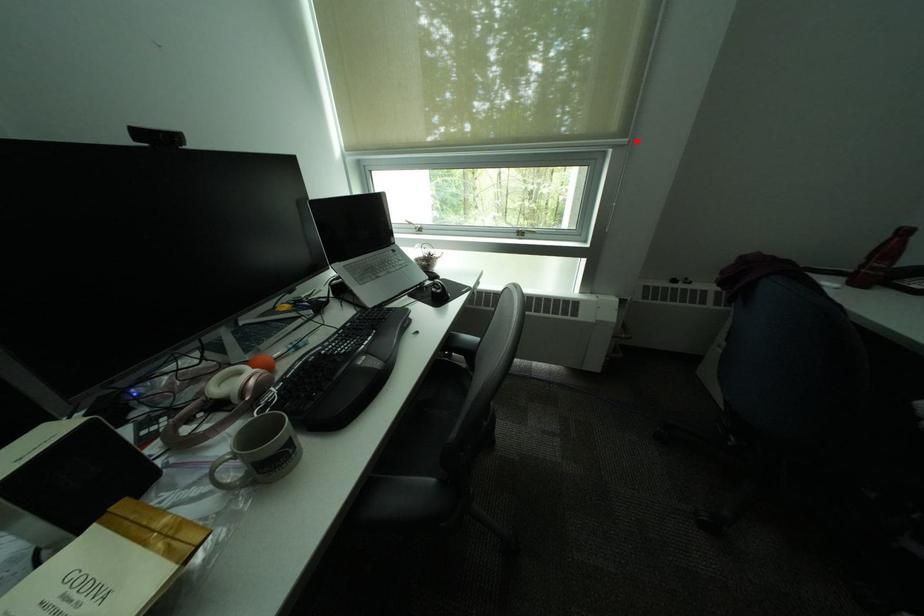
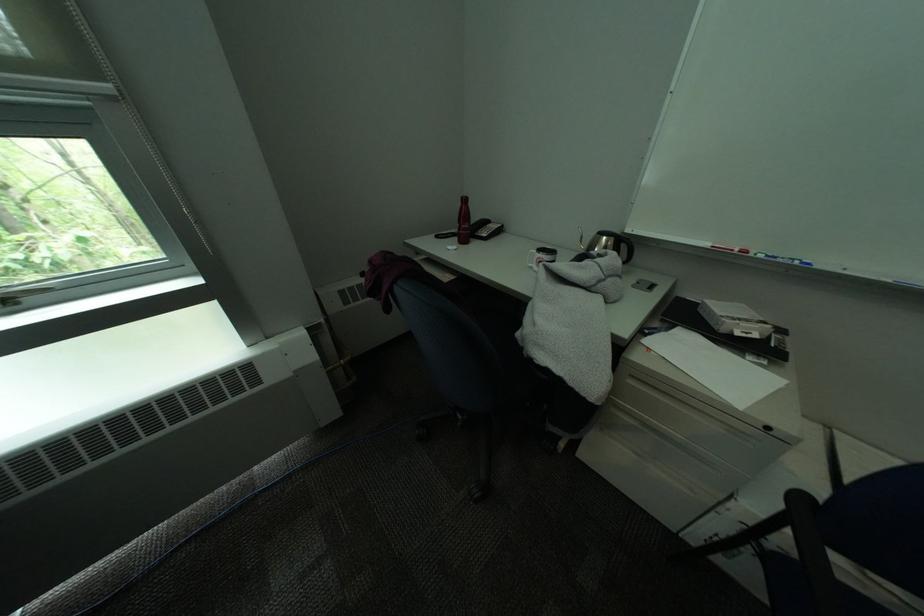
Where in the second image is the point corresponding to the highlighted location from the first image?

(119, 87)